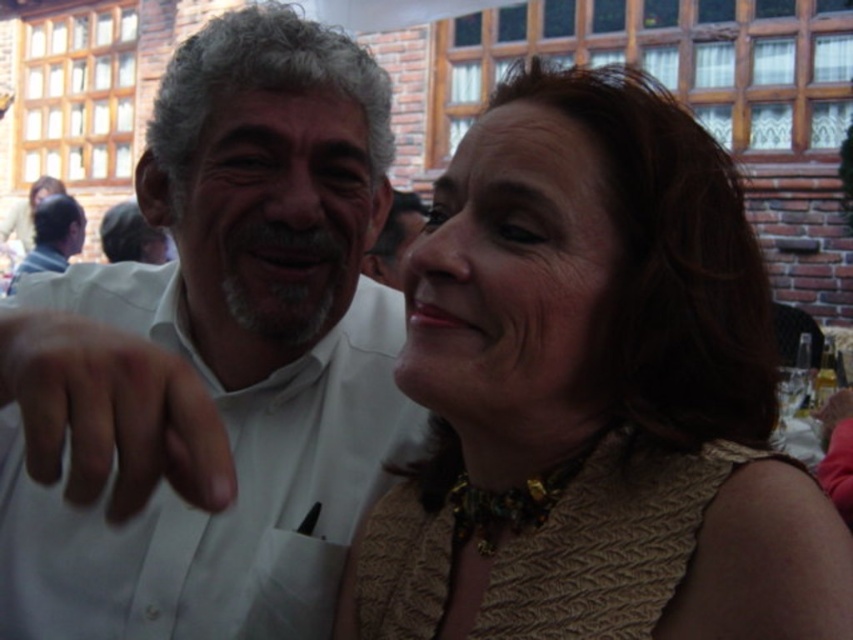
Question: Among these points, which one is nearest to the camera?

Choices:
 (A) (758, 428)
 (B) (73, 227)
 (C) (316, 502)

Answer: (A)

Question: Can you confirm if white matte hand at center is smaller than matte white shirt at left?

Choices:
 (A) yes
 (B) no

Answer: (A)

Question: Can you confirm if gold textured dress at center is positioned below white shirt at center?

Choices:
 (A) yes
 (B) no

Answer: (A)

Question: Which object is the closest to the white shirt at center?

Choices:
 (A) matte white shirt at left
 (B) gold textured dress at center

Answer: (B)

Question: Which object appears farthest from the camera in this image?

Choices:
 (A) white matte hand at center
 (B) matte white shirt at left

Answer: (B)

Question: Can you confirm if gold textured dress at center is positioned above white shirt at center?

Choices:
 (A) yes
 (B) no

Answer: (B)